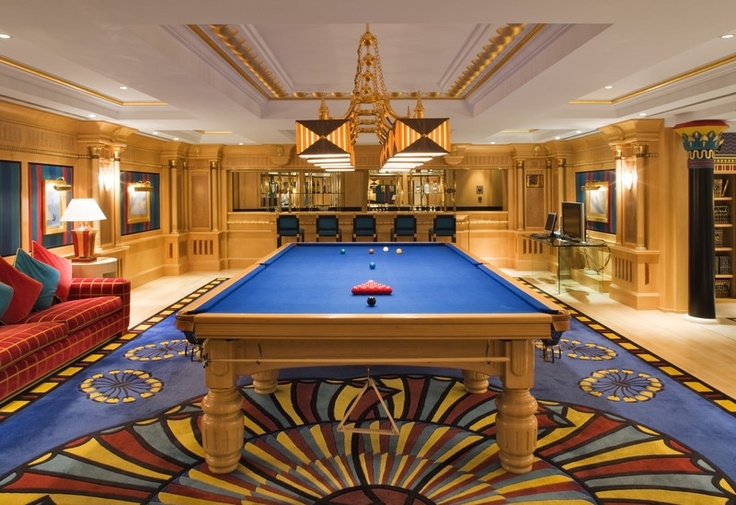
Where is `rug`? Image resolution: width=736 pixels, height=505 pixels. rug is located at coordinates (333, 457).